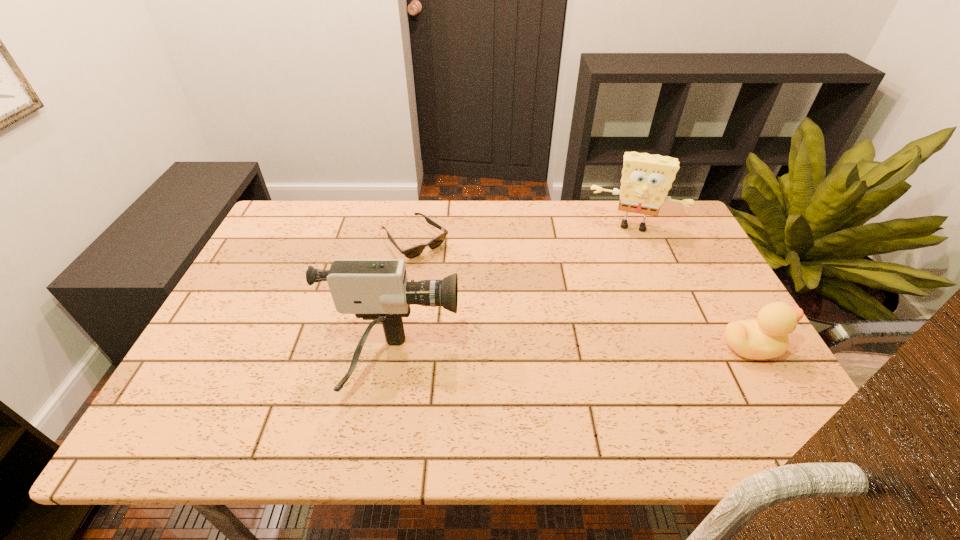
I want to click on vacant space situated on the front-facing side of the sunglasses, so click(455, 280).

This screenshot has width=960, height=540. I want to click on sponge that is at the far edge, so click(x=646, y=179).

Image resolution: width=960 pixels, height=540 pixels. What are the coordinates of `sunglasses that is at the far edge` in the screenshot? It's located at (414, 251).

Find the location of a particular element. This screenshot has height=540, width=960. object located at the near edge is located at coordinates (378, 290).

Locate an element on the screen. duck located at the right edge is located at coordinates (766, 337).

This screenshot has height=540, width=960. I want to click on sponge present at the right edge, so click(x=646, y=179).

Where is `object that is at the far right corner`? object that is at the far right corner is located at coordinates (646, 179).

Identify the location of blank area at the far edge. (499, 244).

You are a GUI agent. You are given a task and a screenshot of the screen. Output one action in this format:
    pyautogui.click(x=<x>, y=<y>)
    Task: Click on the vacant space at the near edge of the desktop
    
    Given the screenshot: What is the action you would take?
    pyautogui.click(x=666, y=385)

This screenshot has height=540, width=960. Find the location of `vacant space at the left edge`. vacant space at the left edge is located at coordinates (243, 364).